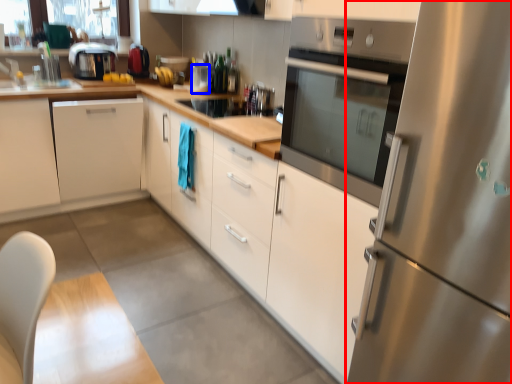
Question: Which point is further to the camera, refrigerator (highlighted by a red box) or appliance (highlighted by a blue box)?

Choices:
 (A) refrigerator
 (B) appliance

Answer: (B)